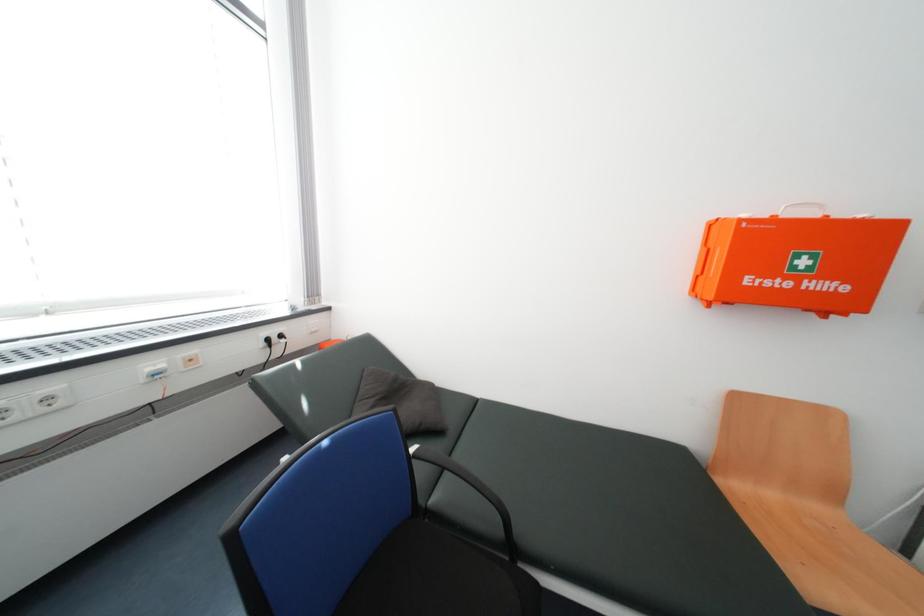
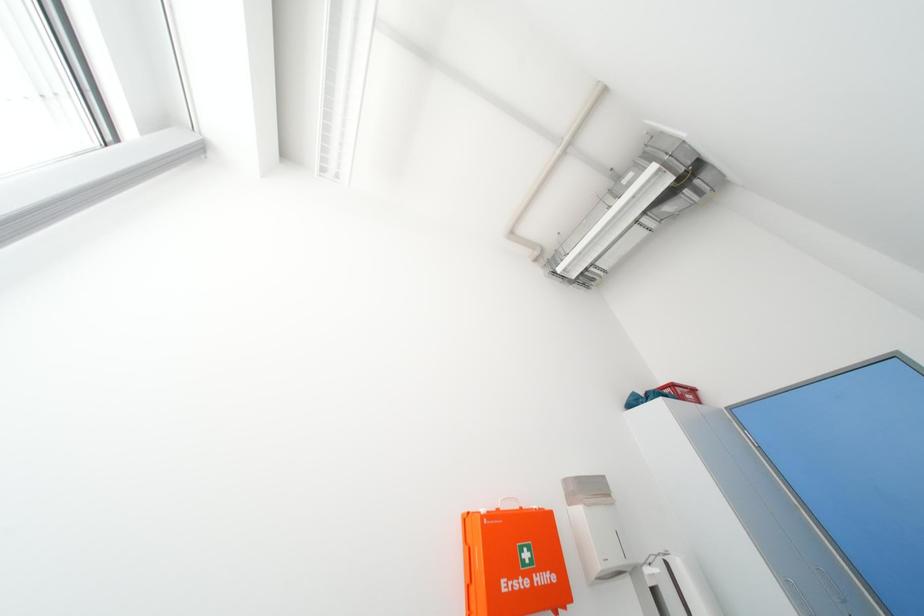
How did the camera likely rotate?

The rotation direction of the camera is right-up.